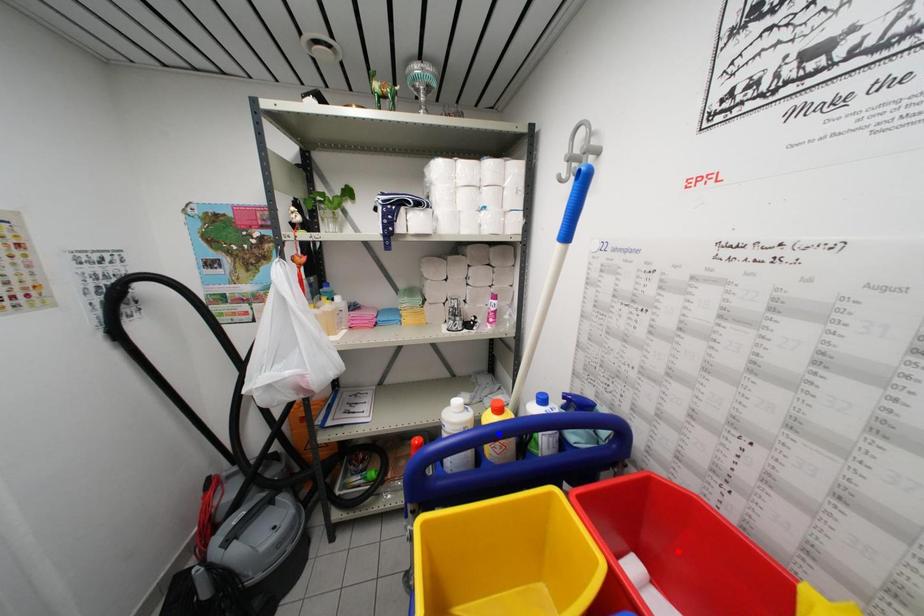
Question: In the image, two points are highlighted. Which point is nearer to the camera? Reply with the corresponding letter.

Choices:
 (A) blue point
 (B) red point

Answer: (B)